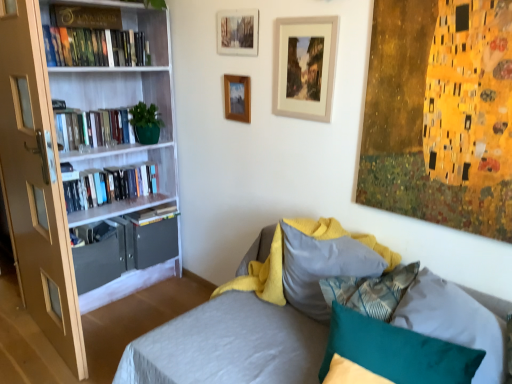
Where is `vacant area located to the right-hand side of matte beige door at left`? The height and width of the screenshot is (384, 512). vacant area located to the right-hand side of matte beige door at left is located at coordinates (128, 327).